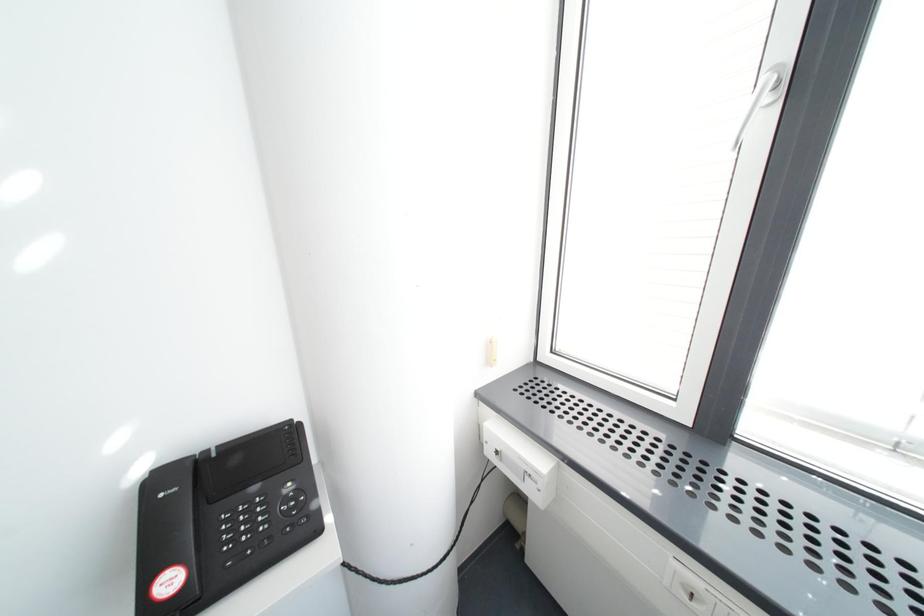
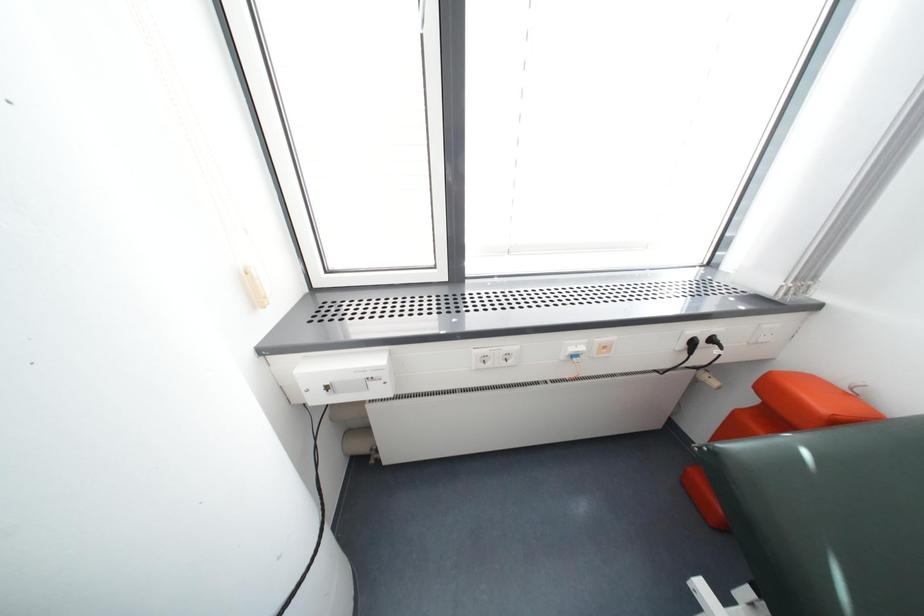
In the scene shown: Based on the continuous images, in which direction is the camera rotating?

The rotation direction of the camera is right-down.